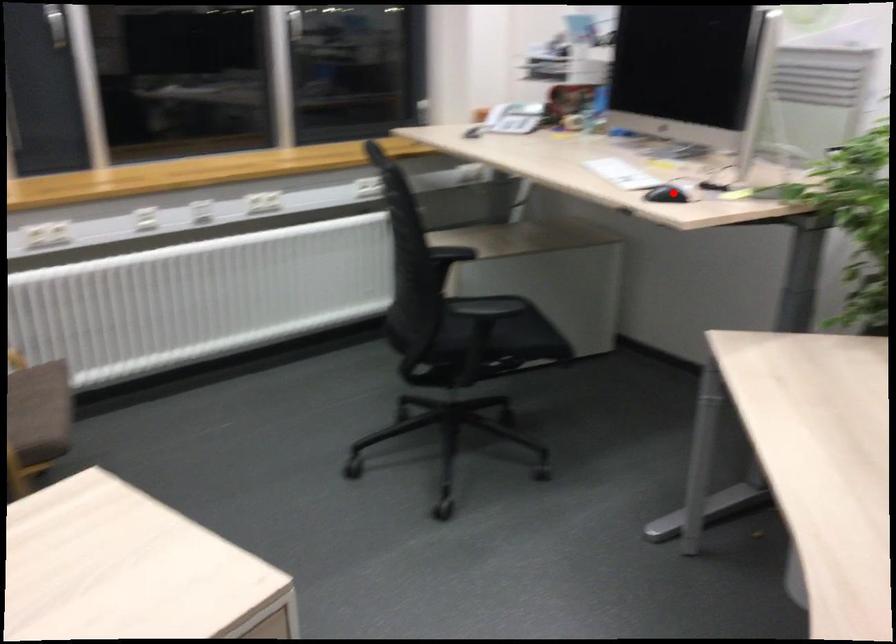
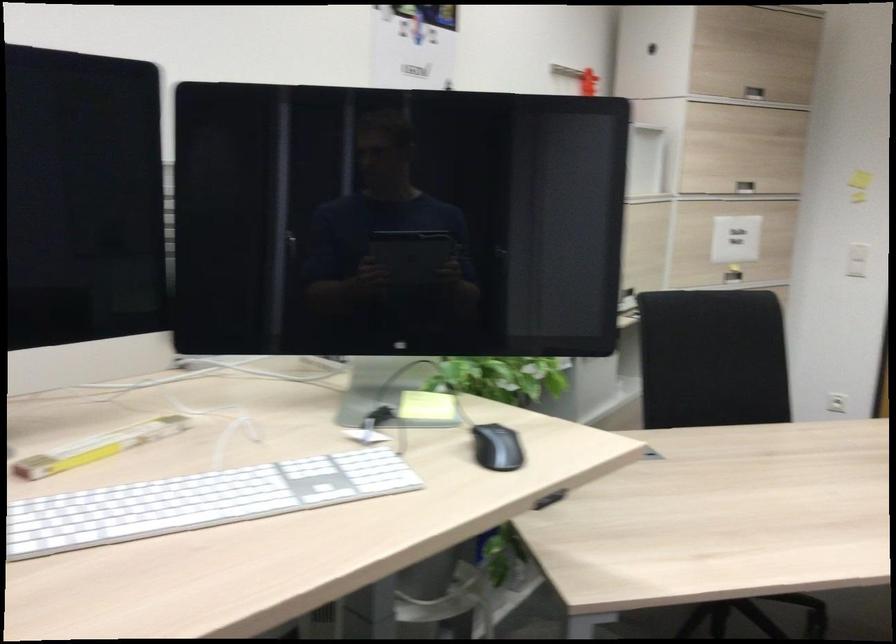
In the second image, find the point that corresponds to the highlighted location in the first image.

(496, 448)